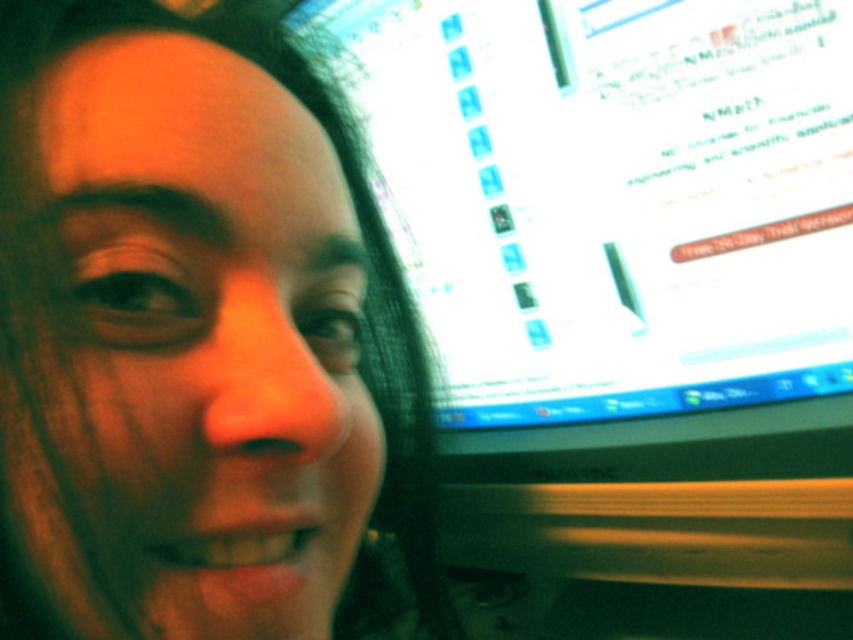
Question: Considering the relative positions of matte skin at center and matte plastic monitor at upper right in the image provided, where is matte skin at center located with respect to matte plastic monitor at upper right?

Choices:
 (A) right
 (B) left

Answer: (B)

Question: Does matte skin at center appear on the right side of matte plastic monitor at upper right?

Choices:
 (A) yes
 (B) no

Answer: (B)

Question: Does matte skin at center have a larger size compared to matte plastic monitor at upper right?

Choices:
 (A) no
 (B) yes

Answer: (A)

Question: Which of the following is the closest to the observer?

Choices:
 (A) (474, 403)
 (B) (161, 541)

Answer: (B)

Question: Which of the following is the farthest from the observer?

Choices:
 (A) matte skin at center
 (B) matte plastic monitor at upper right

Answer: (B)